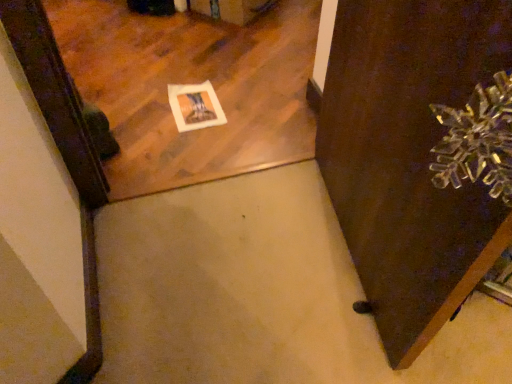
Locate an element on the screen. This screenshot has width=512, height=384. empty space that is ontop of matte wooden mirror at upper left is located at coordinates (148, 49).